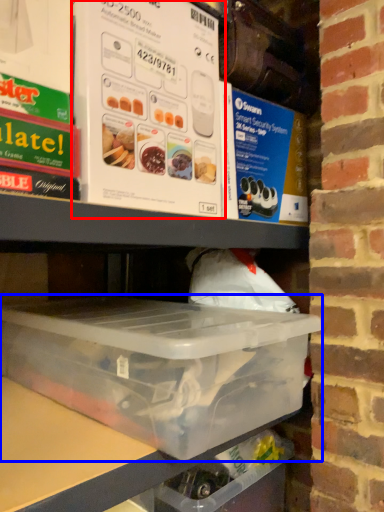
Question: Which object appears farthest to the camera in this image, box (highlighted by a red box) or box (highlighted by a blue box)?

Choices:
 (A) box
 (B) box

Answer: (A)